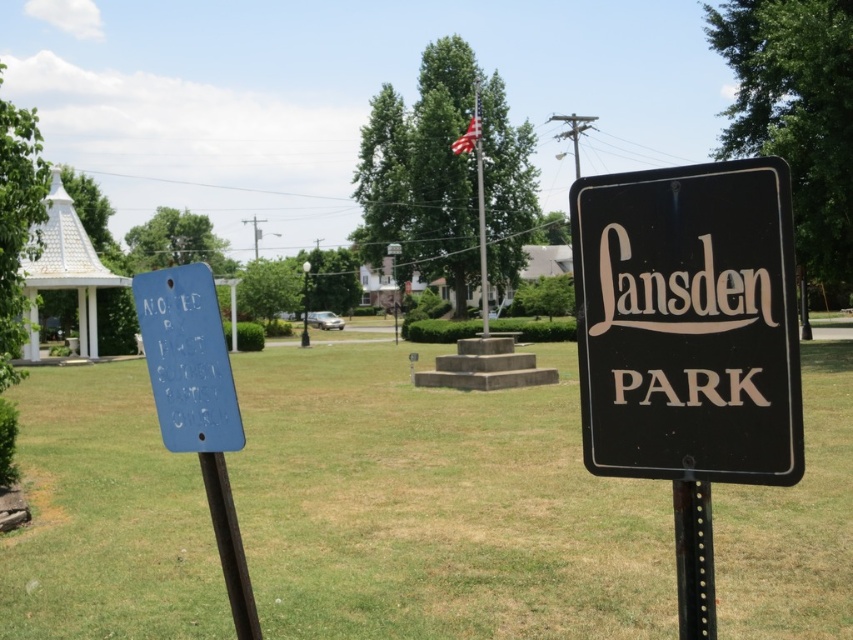
Consider the image. Between black plastic sign at center and black metal pole at lower left, which one is positioned higher?

Positioned higher is black plastic sign at center.

Is black plastic sign at center taller than black metal pole at lower left?

Correct, black plastic sign at center is much taller as black metal pole at lower left.

Is point (585, 362) positioned before point (213, 481)?

Yes.

Where is `black plastic sign at center`? This screenshot has height=640, width=853. black plastic sign at center is located at coordinates (688, 323).

Who is shorter, blue painted metal sign at left or white shingled gazebo at left?

blue painted metal sign at left is shorter.

Does point (178, 369) lie behind point (26, 342)?

No, it is in front of (26, 342).

The image size is (853, 640). I want to click on blue painted metal sign at left, so click(187, 358).

Who is lower down, black plastic sign at center or white shingled gazebo at left?

Positioned lower is black plastic sign at center.

Identify the location of black plastic sign at center. (688, 323).

Which is behind, point (744, 314) or point (54, 289)?

Positioned behind is point (54, 289).

You are a GUI agent. You are given a task and a screenshot of the screen. Output one action in this format:
    pyautogui.click(x=<x>, y=<y>)
    Task: Click on the black plastic sign at center
    This screenshot has height=640, width=853.
    Given the screenshot: What is the action you would take?
    pyautogui.click(x=688, y=323)